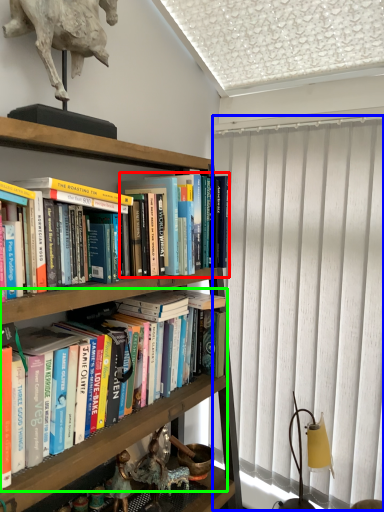
Question: Considering the real-world distances, which object is farthest from book (highlighted by a red box)? curtain (highlighted by a blue box) or book (highlighted by a green box)?

Choices:
 (A) curtain
 (B) book

Answer: (B)